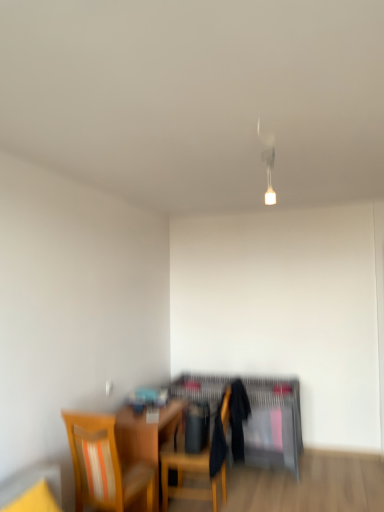
Question: Choose the correct answer: Is wooden table at center inside matte black desk at center or outside it?

Choices:
 (A) inside
 (B) outside

Answer: (B)

Question: In the image, is wooden table at center on the left side or the right side of matte black desk at center?

Choices:
 (A) right
 (B) left

Answer: (B)

Question: Estimate the real-world distances between objects in this image. Which object is closer to the wooden table at center?

Choices:
 (A) matte black desk at center
 (B) wooden chair at center, the second chair viewed from the left
 (C) wooden chair with striped cushion at lower left, which is the 1th chair from left to right

Answer: (B)

Question: Which object is the closest to the matte black desk at center?

Choices:
 (A) wooden chair with striped cushion at lower left, marked as the 2th chair in a back-to-front arrangement
 (B) wooden table at center
 (C) wooden chair at center, the second chair viewed from the left

Answer: (C)